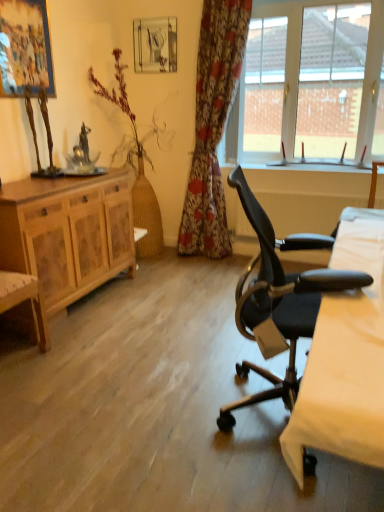
Question: Could you tell me if bare wood vase at left is facing floral fabric curtain at center?

Choices:
 (A) yes
 (B) no

Answer: (A)

Question: Is bare wood vase at left thinner than floral fabric curtain at center?

Choices:
 (A) yes
 (B) no

Answer: (B)

Question: From a real-world perspective, does bare wood vase at left sit lower than floral fabric curtain at center?

Choices:
 (A) no
 (B) yes

Answer: (B)

Question: Is bare wood vase at left not near floral fabric curtain at center?

Choices:
 (A) yes
 (B) no

Answer: (B)

Question: From the image's perspective, is bare wood vase at left located beneath floral fabric curtain at center?

Choices:
 (A) yes
 (B) no

Answer: (A)

Question: Is floral fabric curtain at center taller or shorter than white glass window at upper right?

Choices:
 (A) tall
 (B) short

Answer: (A)

Question: From the image's perspective, is floral fabric curtain at center positioned above or below white glass window at upper right?

Choices:
 (A) above
 (B) below

Answer: (B)

Question: Looking at their shapes, would you say floral fabric curtain at center is wider or thinner than white glass window at upper right?

Choices:
 (A) wide
 (B) thin

Answer: (A)

Question: Is floral fabric curtain at center inside the boundaries of white glass window at upper right, or outside?

Choices:
 (A) outside
 (B) inside

Answer: (A)

Question: Considering the relative positions of white glass window at upper right and metallic glass picture frame at upper center, marked as the first picture frame in a back-to-front arrangement, in the image provided, is white glass window at upper right to the left or to the right of metallic glass picture frame at upper center, marked as the first picture frame in a back-to-front arrangement,?

Choices:
 (A) right
 (B) left

Answer: (A)

Question: From the image's perspective, is white glass window at upper right above or below metallic glass picture frame at upper center, acting as the first picture frame starting from the right?

Choices:
 (A) below
 (B) above

Answer: (A)

Question: Is point (263, 52) closer or farther from the camera than point (162, 23)?

Choices:
 (A) farther
 (B) closer

Answer: (B)

Question: From a real-world perspective, is white glass window at upper right above or below metallic glass picture frame at upper center, acting as the first picture frame starting from the right?

Choices:
 (A) above
 (B) below

Answer: (B)

Question: Would you say black leather office chair at right is inside or outside wooden cabinet at left?

Choices:
 (A) outside
 (B) inside

Answer: (A)

Question: Based on their sizes in the image, would you say black leather office chair at right is bigger or smaller than wooden cabinet at left?

Choices:
 (A) big
 (B) small

Answer: (B)